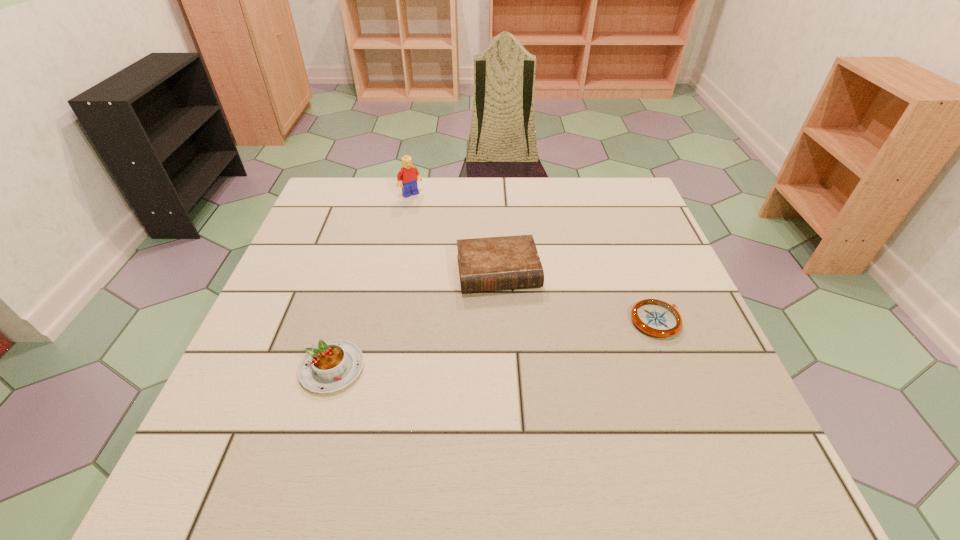
You are a GUI agent. You are given a task and a screenshot of the screen. Output one action in this format:
    pyautogui.click(x=<x>, y=<y>)
    Task: Click on the vacant space on the desktop that is between the nearest object and the shortest object and is positioned on the face of the Lego
    
    Given the screenshot: What is the action you would take?
    pyautogui.click(x=538, y=339)

Locate an element on the screen. Image resolution: width=960 pixels, height=540 pixels. free spot on the desktop that is between the pudding and the shortest object and is positioned on the spine side of the second farthest object is located at coordinates (513, 342).